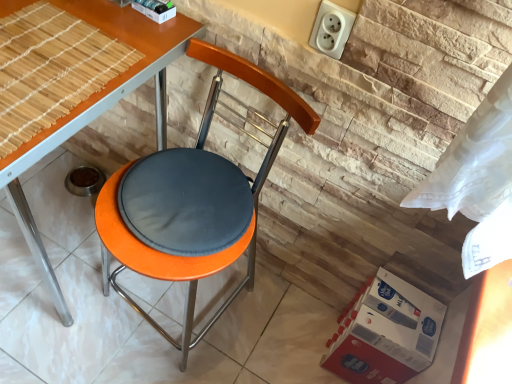
Where is `free space between orange matte table at center and orange fabric-covered chair at center`? The image size is (512, 384). free space between orange matte table at center and orange fabric-covered chair at center is located at coordinates [x=115, y=357].